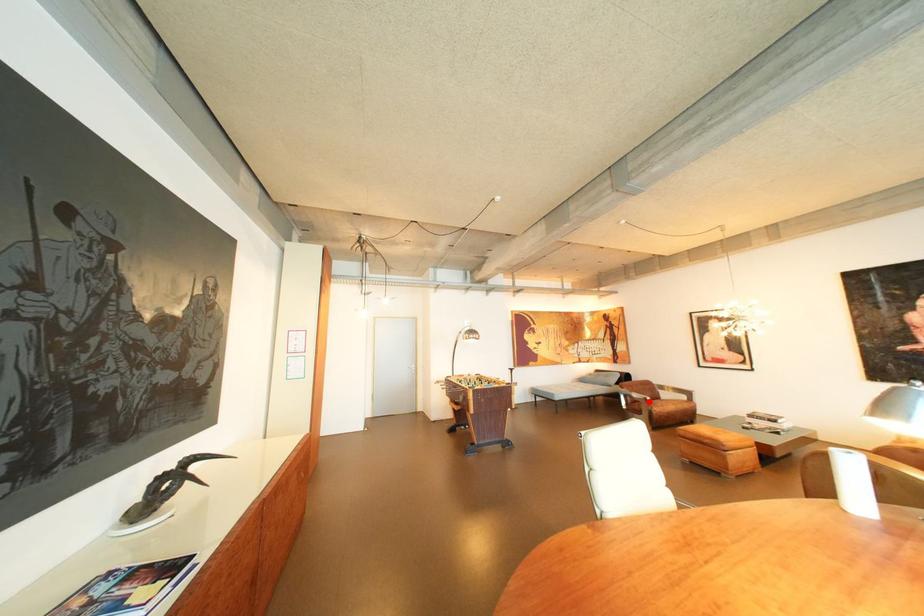
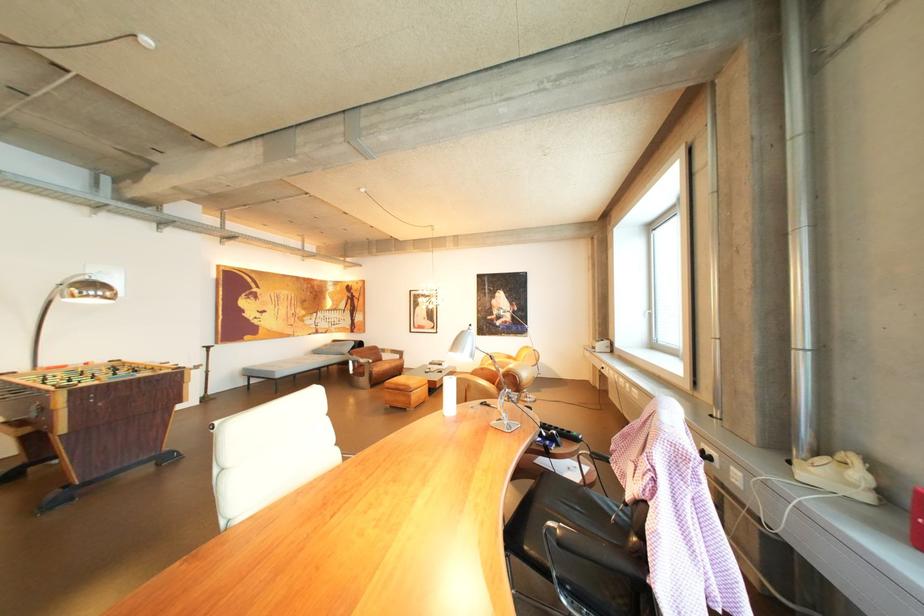
The point at the highlighted location is marked in the first image. Where is the corresponding point in the second image?

(374, 366)